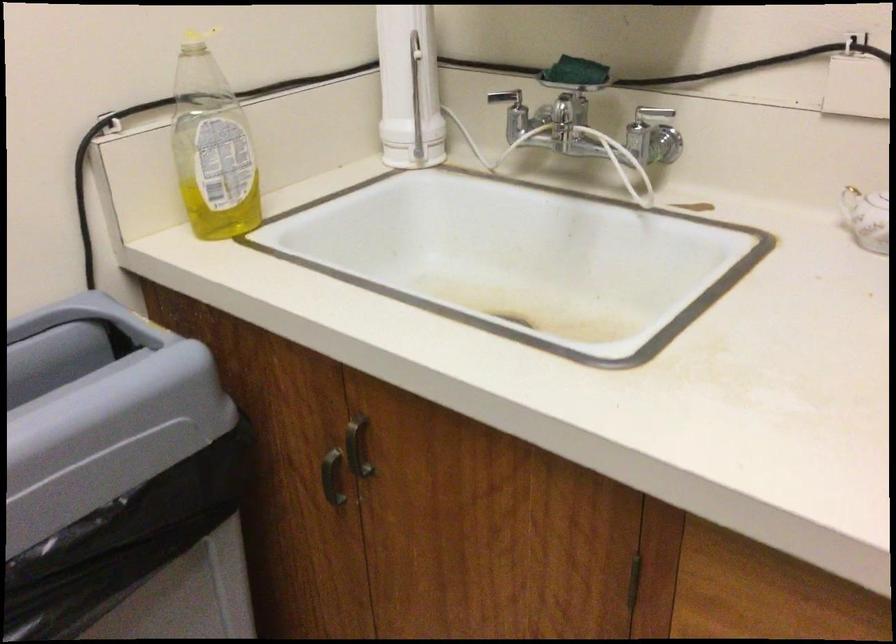
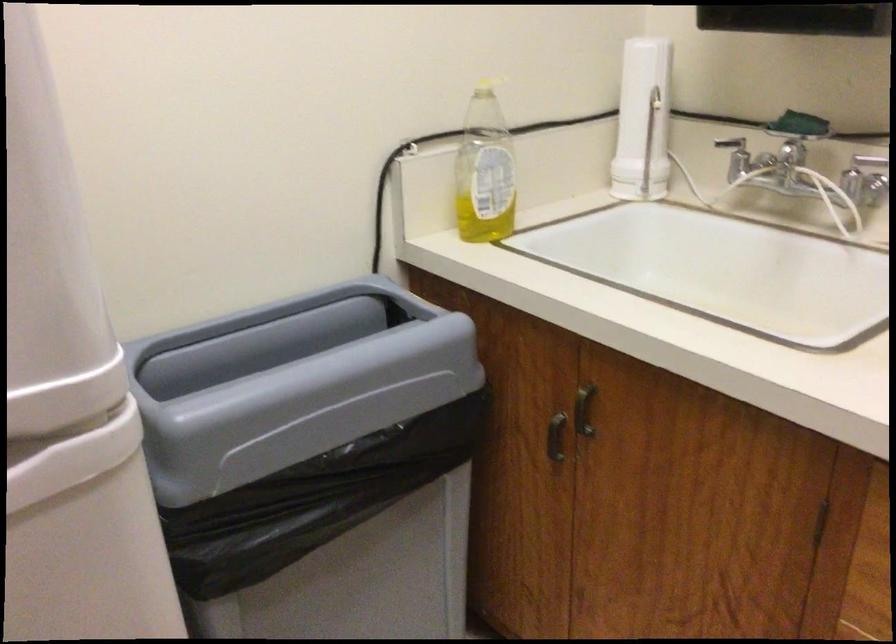
The images are taken continuously from a first-person perspective. In which direction are you moving?

The cameraman moved toward left, backward.